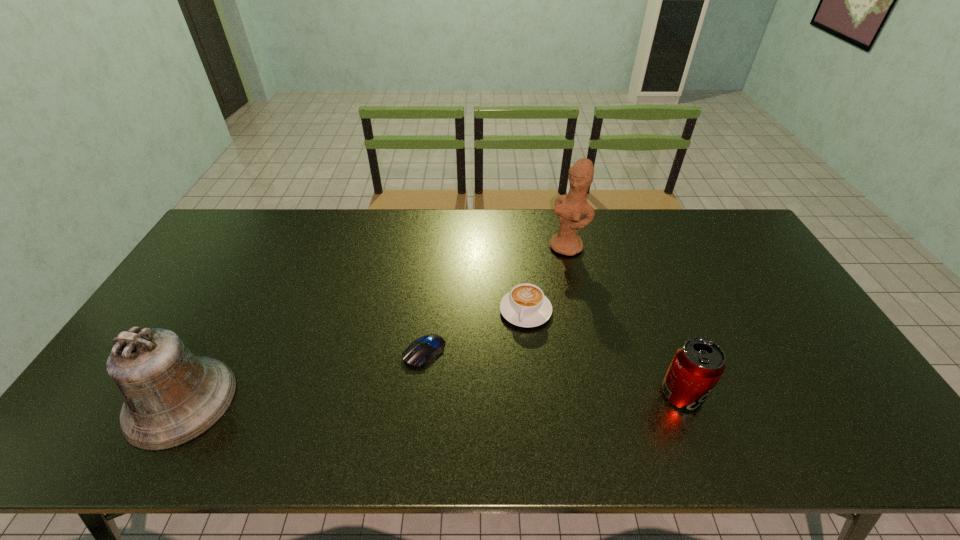
At what (x,y) coordinates should I click in order to perform the action: click on the leftmost object. Please return your answer as a coordinate pair (x, y). This screenshot has width=960, height=540. Looking at the image, I should click on (171, 397).

Identify the location of bell. (171, 397).

Locate an element on the screen. soda can is located at coordinates (699, 363).

You are a GUI agent. You are given a task and a screenshot of the screen. Output one action in this format:
    pyautogui.click(x=<x>, y=<y>)
    Task: Click on the third shortest object
    This screenshot has width=960, height=540.
    Given the screenshot: What is the action you would take?
    pyautogui.click(x=699, y=363)

This screenshot has height=540, width=960. What are the coordinates of `the second farthest object` in the screenshot? It's located at (526, 305).

Locate an element on the screen. the second shortest object is located at coordinates (526, 305).

The height and width of the screenshot is (540, 960). I want to click on the shortest object, so click(427, 347).

At what (x,y) coordinates should I click in order to perform the action: click on computer mouse. Please return your answer as a coordinate pair (x, y). Image resolution: width=960 pixels, height=540 pixels. Looking at the image, I should click on (427, 347).

You are a GUI agent. You are given a task and a screenshot of the screen. Output one action in this format:
    pyautogui.click(x=<x>, y=<y>)
    Task: Click on the tallest object
    
    Given the screenshot: What is the action you would take?
    pyautogui.click(x=570, y=208)

Locate an element on the screen. Image resolution: width=960 pixels, height=540 pixels. the second object from right to left is located at coordinates (570, 208).